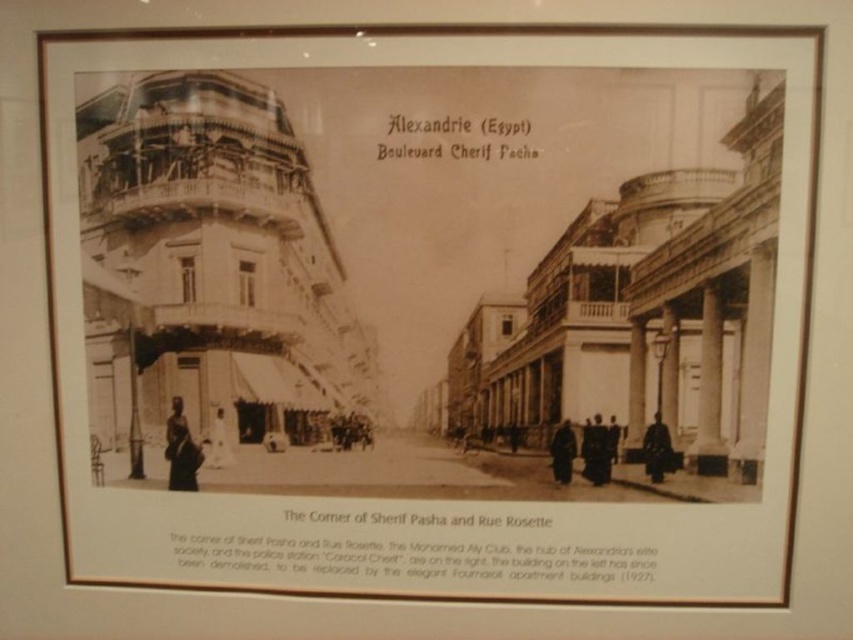
You are an art curator examining this historical photograph of Alexandria. You notice two individuals in the scene. The first is a dark skin figure at lower left, and the second is a dark skin person at center. Based on their sizes in the photograph, which of these two figures is closer to the camera?

The dark skin figure at lower left is larger in size than the dark skin person at center, so the dark skin figure at lower left is closer to the camera.

You are a historian examining this historical photograph of Alexandria. You notice a dark brown leather coat at center. Based on its position coordinates, can you determine if it is closer to the left or right side of the image?

The dark brown leather coat at center is located at coordinates point (561, 451). Since the x coordinate is 0.706, which is closer to 1.0, it is positioned more towards the right side of the image.

You are an anthropologist analyzing the clothing and body proportions in this historical photograph of Alexandria. You observe the dark brown leather coat at right and the dark skin person at center. Which object is wider in the image?

The dark brown leather coat at right is wider than the dark skin person at center according to the description provided.